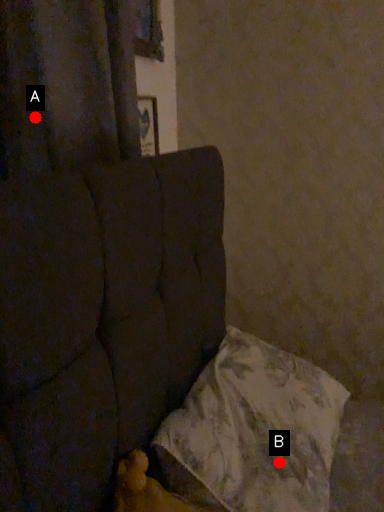
Question: Two points are circled on the image, labeled by A and B beside each circle. Among these points, which one is farthest from the camera?

Choices:
 (A) A is further
 (B) B is further

Answer: (A)